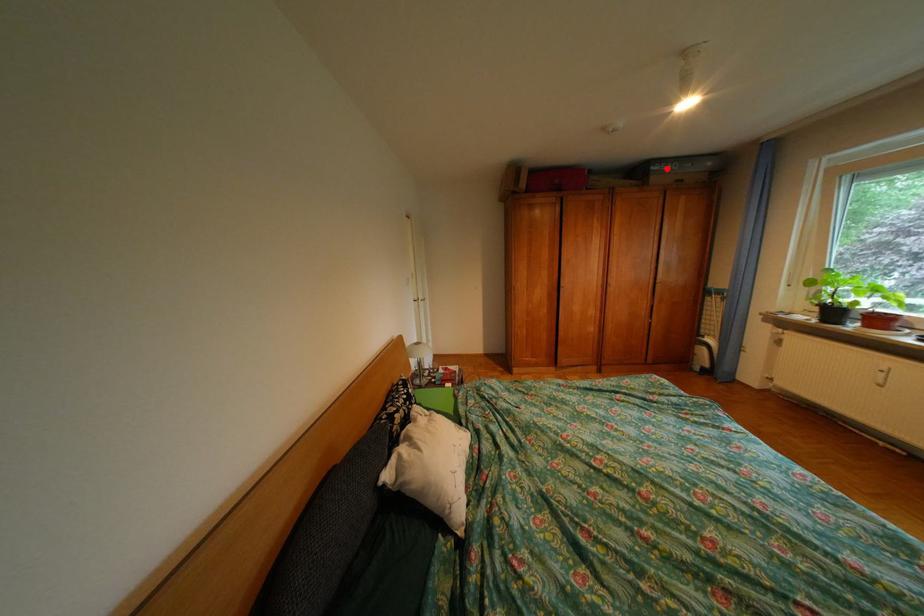
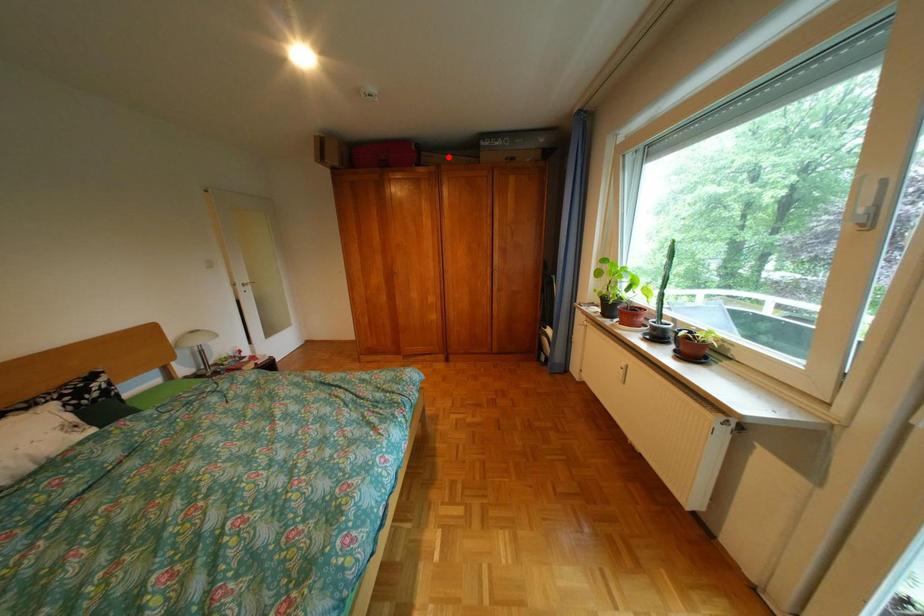
I am providing you with two images of the same scene from different viewpoints. A red point is marked on the first image and another point is marked on the second image. Are the points marked in image1 and image2 representing the same 3D position?

No